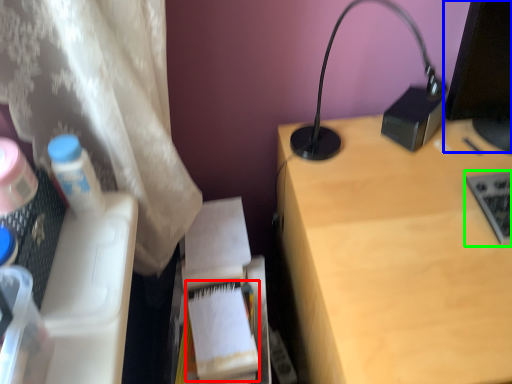
Question: Which is farther away from paperback book (highlighted by a red box)? computer screen (highlighted by a blue box) or laptop keyboard (highlighted by a green box)?

Choices:
 (A) computer screen
 (B) laptop keyboard

Answer: (A)